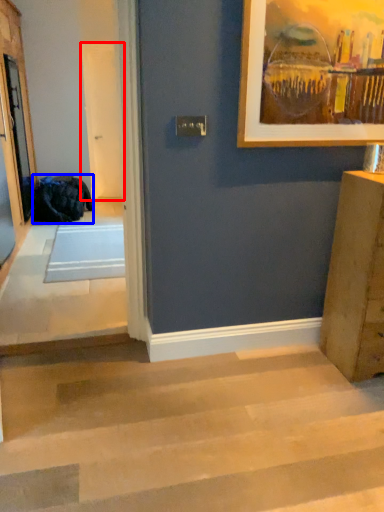
Question: Which point is further to the camera, screen door (highlighted by a red box) or laundry (highlighted by a blue box)?

Choices:
 (A) screen door
 (B) laundry

Answer: (A)